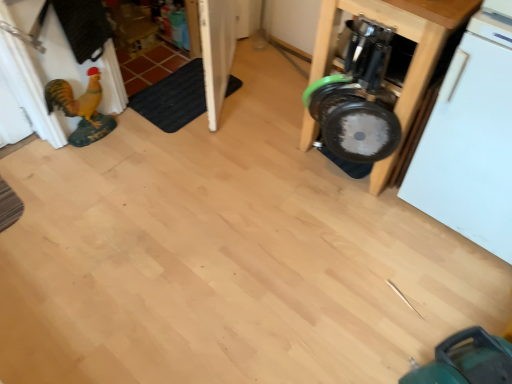
This screenshot has width=512, height=384. I want to click on free space in front of black rubber mat at lower left, so 175,152.